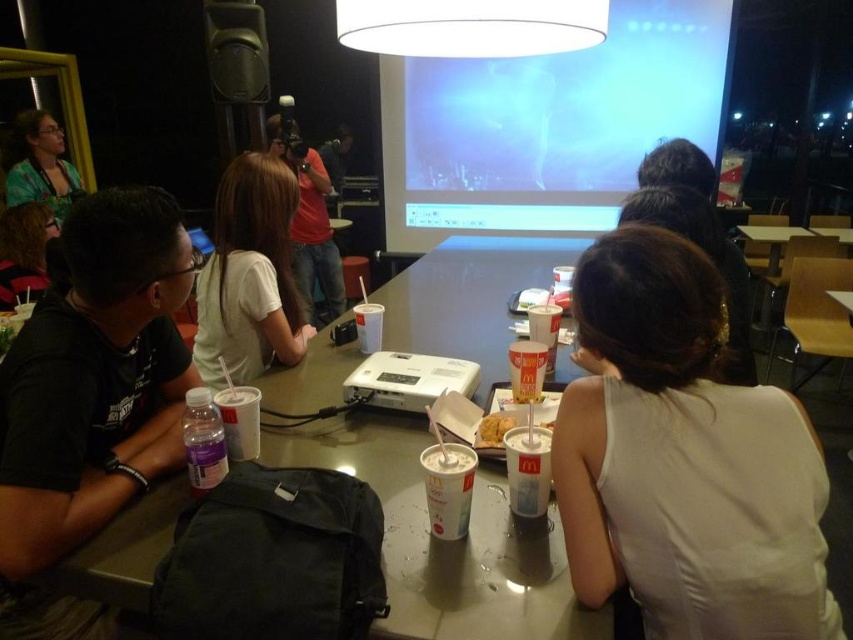
Is point (498, 291) more distant than point (21, 243)?

No, it is not.

Consider the image. Can you confirm if matte plastic table at center is wider than matte black hair at upper left?

Indeed, matte plastic table at center has a greater width compared to matte black hair at upper left.

Where is `matte plastic table at center`? matte plastic table at center is located at coordinates [445, 541].

Measure the distance between clear plastic bottle at center and matte black camera at upper center.

clear plastic bottle at center and matte black camera at upper center are 4.97 meters apart from each other.

Is clear plastic bottle at center in front of matte black camera at upper center?

Yes, it is in front of matte black camera at upper center.

Does point (187, 468) lie in front of point (337, 168)?

Yes, point (187, 468) is in front of point (337, 168).

Image resolution: width=853 pixels, height=640 pixels. What are the coordinates of `clear plastic bottle at center` in the screenshot? It's located at (202, 440).

Can you confirm if white paper cup at center is positioned above matte black camera at upper center?

No.

Locate an element on the screen. This screenshot has width=853, height=640. white paper cup at center is located at coordinates (448, 488).

Image resolution: width=853 pixels, height=640 pixels. Identify the location of white paper cup at center. (448, 488).